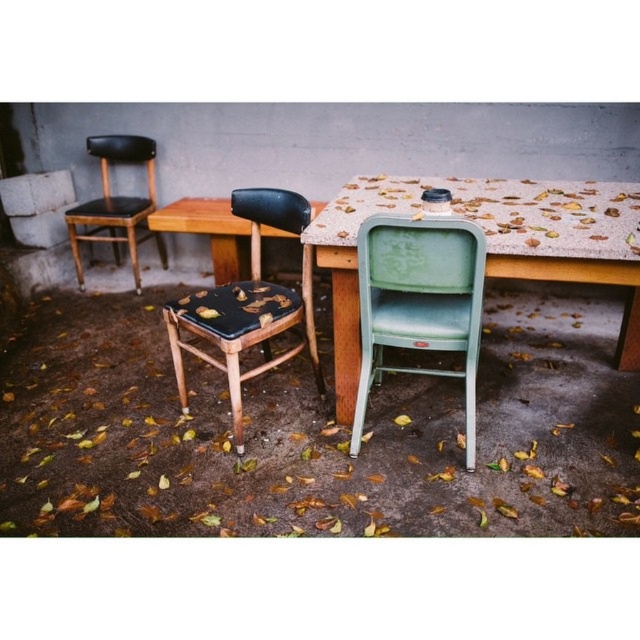
You are setting up a small outdoor event and need to place a 12 inch wide decorative vase between the speckled concrete table at center and the green matte folding chair at center. Based on the spacing between them, will the vase fit comfortably without overlapping either object?

The distance between the speckled concrete table at center and the green matte folding chair at center is 11.25 inches. Since the vase is 12 inches wide, it would not fit comfortably between them as the space is narrower than the vase.

You are setting up a small table for two guests. You have a speckled concrete table at center and a green matte folding chair at center. If you want to place the chair to the left of the table, is it currently positioned correctly?

Yes, the green matte folding chair at center is already positioned to the left of the speckled concrete table at center, which is to its right.

You are planning to seat guests at an outdoor event and need to choose between the matte black seat at center and the matte black chair at left. Which one can accommodate more people if you have limited space?

The matte black seat at center is larger in size than the matte black chair at left, so it can accommodate more people in limited space.